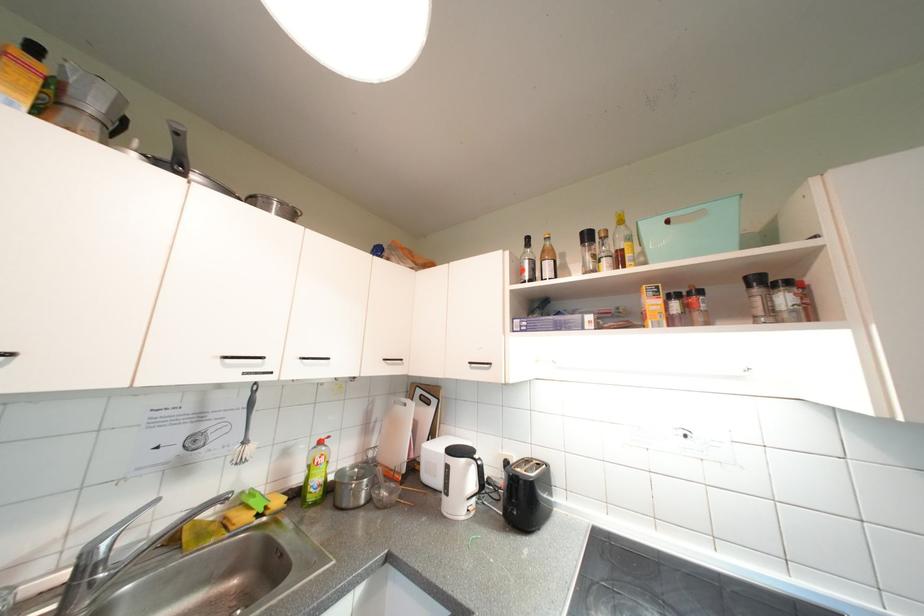
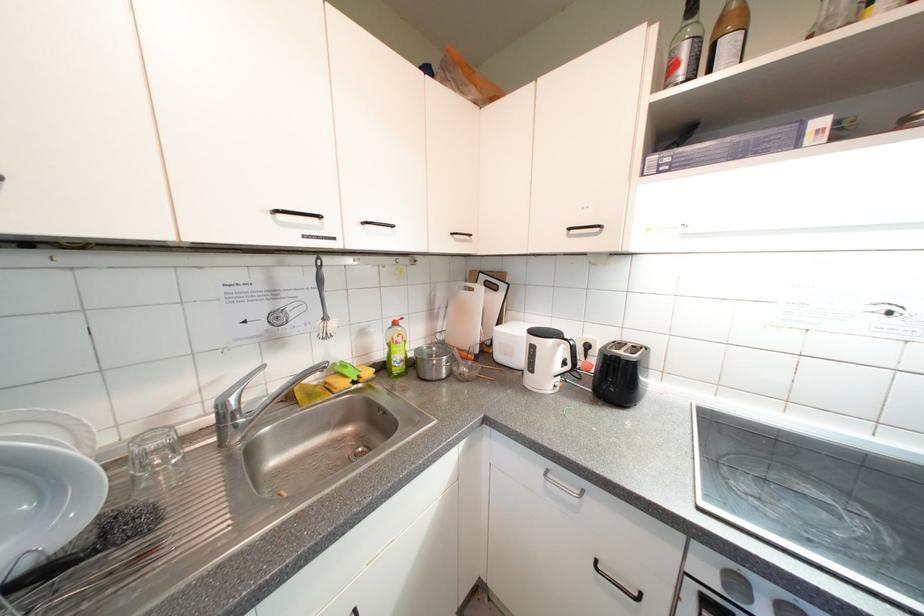
Find the pixel in the second image that matches point 324,483 in the first image.

(406, 358)